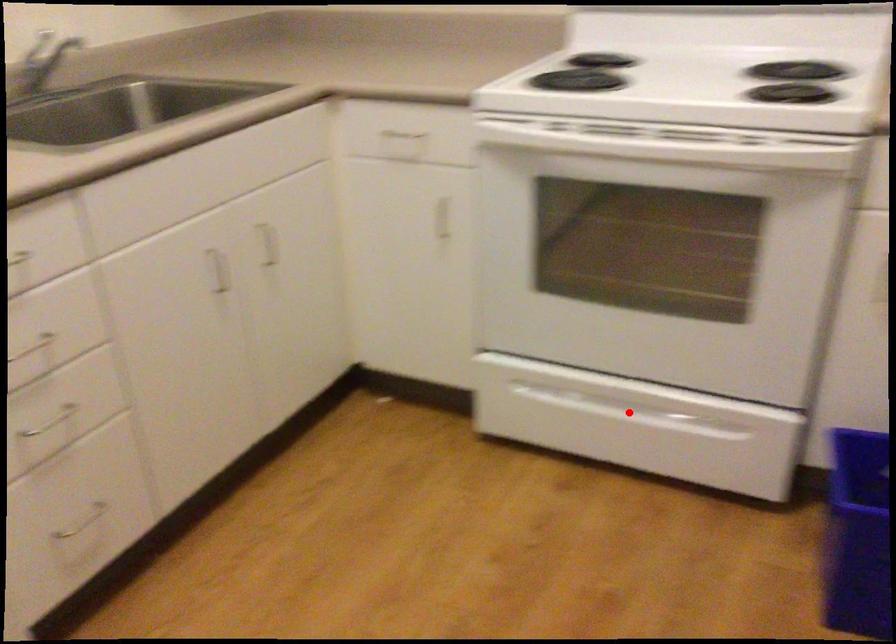
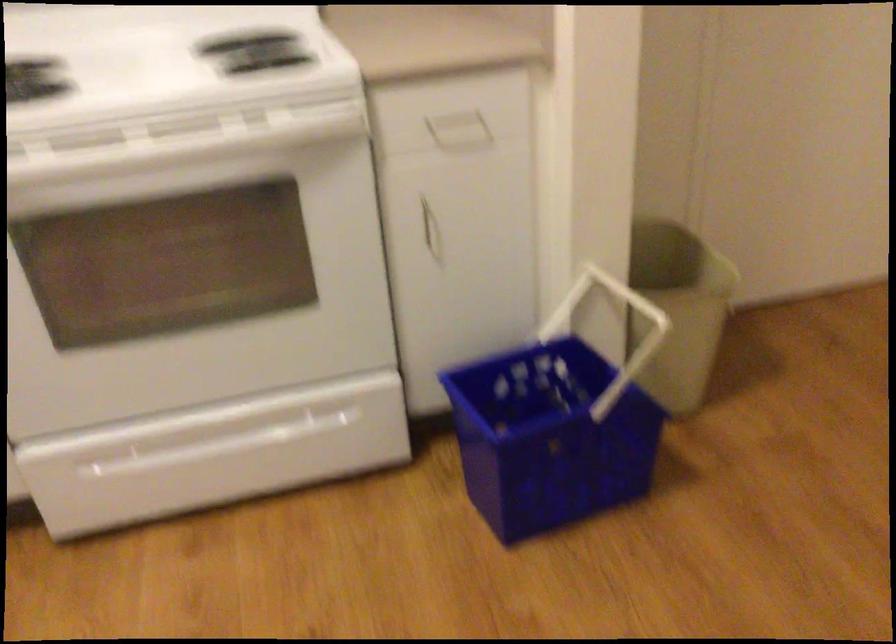
Locate, in the second image, the point that corresponds to the highlighted location in the first image.

(233, 440)